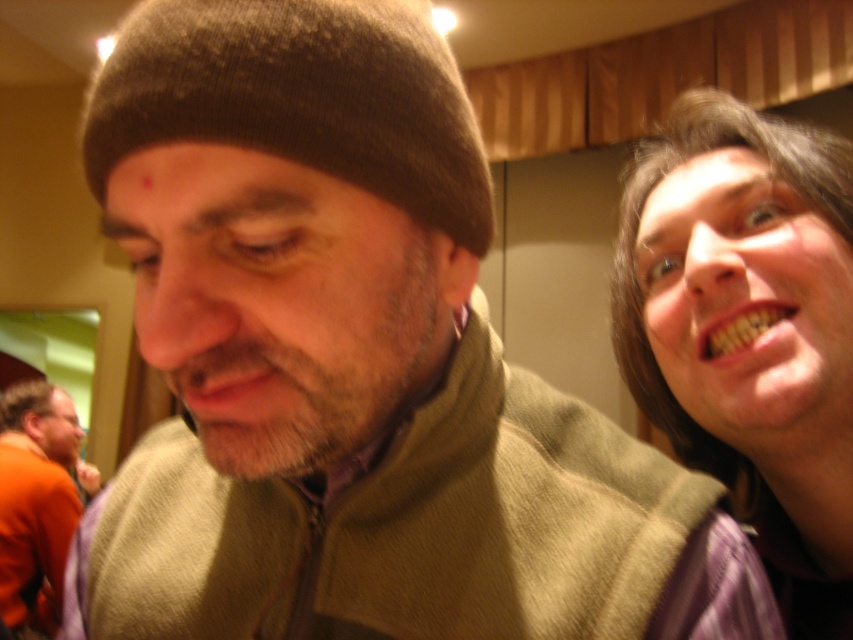
Does brown knit beanie at upper left appear under orange matte shirt at lower left?

Actually, brown knit beanie at upper left is above orange matte shirt at lower left.

Does brown knit beanie at upper left have a lesser height compared to orange matte shirt at lower left?

Yes.

The image size is (853, 640). In order to click on brown knit beanie at upper left in this screenshot , I will do `click(300, 99)`.

Is matte purple shirt at right positioned in front of brown knit beanie at upper left?

No.

Can you confirm if matte purple shirt at right is bigger than brown knit beanie at upper left?

Yes, matte purple shirt at right is bigger than brown knit beanie at upper left.

This screenshot has width=853, height=640. I want to click on matte purple shirt at right, so click(749, 330).

Does point (694, 317) come farther from viewer compared to point (50, 538)?

No, (694, 317) is in front of (50, 538).

Which is below, matte purple shirt at right or orange matte shirt at lower left?

orange matte shirt at lower left is lower down.

Identify the location of matte purple shirt at right. (749, 330).